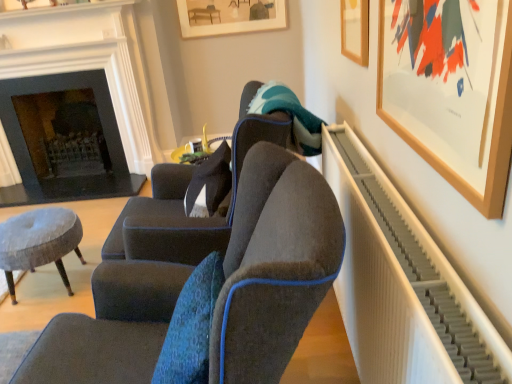
Question: Can you confirm if wooden picture frame at upper right, which appears as the second picture frame when viewed from the front, is taller than wooden picture frame at upper right, the third picture frame positioned from the top?

Choices:
 (A) yes
 (B) no

Answer: (B)

Question: Does wooden picture frame at upper right, positioned as the 2th picture frame in right-to-left order, touch wooden picture frame at upper right, the third picture frame positioned from the top?

Choices:
 (A) no
 (B) yes

Answer: (A)

Question: Is wooden picture frame at upper right, positioned as the 2th picture frame in right-to-left order, positioned before wooden picture frame at upper right, the third picture frame positioned from the top?

Choices:
 (A) no
 (B) yes

Answer: (A)

Question: Can you confirm if wooden picture frame at upper right, positioned as the 2th picture frame in right-to-left order, is smaller than wooden picture frame at upper right, the third picture frame positioned from the top?

Choices:
 (A) no
 (B) yes

Answer: (B)

Question: From a real-world perspective, is wooden picture frame at upper right, the 2th picture frame when ordered from back to front, on wooden picture frame at upper right, the 1th picture frame in the right-to-left sequence?

Choices:
 (A) yes
 (B) no

Answer: (A)

Question: Based on their positions, is wooden picture frame at upper right, the 3th picture frame viewed from the back, located to the left or right of dark gray stone fireplace at left?

Choices:
 (A) left
 (B) right

Answer: (B)

Question: Considering the positions of wooden picture frame at upper right, which ranks as the 3th picture frame in left-to-right order, and dark gray stone fireplace at left in the image, is wooden picture frame at upper right, which ranks as the 3th picture frame in left-to-right order, taller or shorter than dark gray stone fireplace at left?

Choices:
 (A) short
 (B) tall

Answer: (A)

Question: In terms of width, does wooden picture frame at upper right, the 3th picture frame viewed from the back, look wider or thinner when compared to dark gray stone fireplace at left?

Choices:
 (A) thin
 (B) wide

Answer: (A)

Question: Considering the positions of wooden picture frame at upper right, which ranks as the 3th picture frame in left-to-right order, and dark gray stone fireplace at left in the image, is wooden picture frame at upper right, which ranks as the 3th picture frame in left-to-right order, bigger or smaller than dark gray stone fireplace at left?

Choices:
 (A) small
 (B) big

Answer: (A)

Question: In terms of size, does wooden framed artwork at upper center, acting as the 3th picture frame starting from the bottom, appear bigger or smaller than dark gray stone fireplace at left?

Choices:
 (A) big
 (B) small

Answer: (B)

Question: Considering the positions of wooden framed artwork at upper center, which is the first picture frame from left to right, and dark gray stone fireplace at left in the image, is wooden framed artwork at upper center, which is the first picture frame from left to right, taller or shorter than dark gray stone fireplace at left?

Choices:
 (A) short
 (B) tall

Answer: (A)

Question: From the image's perspective, is wooden framed artwork at upper center, which is the third picture frame in right-to-left order, positioned above or below dark gray stone fireplace at left?

Choices:
 (A) below
 (B) above

Answer: (B)

Question: From a real-world perspective, is wooden framed artwork at upper center, which is the third picture frame in right-to-left order, positioned above or below dark gray stone fireplace at left?

Choices:
 (A) below
 (B) above

Answer: (B)

Question: In terms of height, does wooden picture frame at upper right, the 2th picture frame when ordered from back to front, look taller or shorter compared to wooden framed artwork at upper center, which is the third picture frame in right-to-left order?

Choices:
 (A) tall
 (B) short

Answer: (B)

Question: Considering the positions of wooden picture frame at upper right, the 2th picture frame when ordered from back to front, and wooden framed artwork at upper center, positioned as the first picture frame in top-to-bottom order, in the image, is wooden picture frame at upper right, the 2th picture frame when ordered from back to front, wider or thinner than wooden framed artwork at upper center, positioned as the first picture frame in top-to-bottom order,?

Choices:
 (A) wide
 (B) thin

Answer: (B)